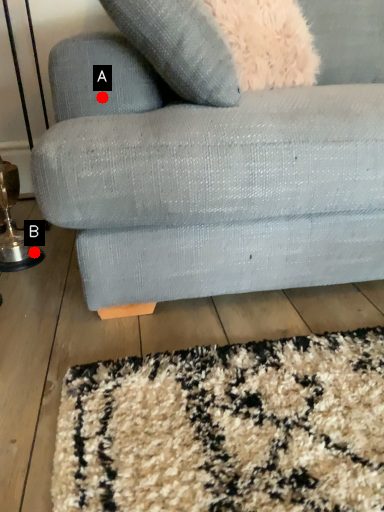
Question: Two points are circled on the image, labeled by A and B beside each circle. Which point is closer to the camera?

Choices:
 (A) A is closer
 (B) B is closer

Answer: (A)